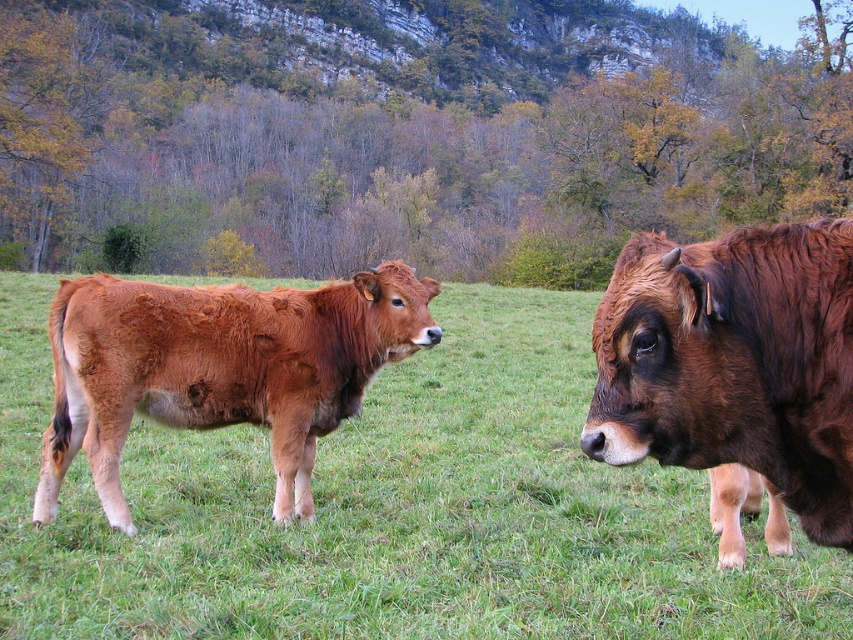
Who is lower down, green grass at center or brown glossy cow at right?

brown glossy cow at right is below.

I want to click on green grass at center, so coord(393,509).

Measure the distance between point (619, 538) and camera.

4.47 meters

Where is `green grass at center`? green grass at center is located at coordinates (393, 509).

Who is positioned more to the left, brown glossy cow at right or brown furry calf at left?

From the viewer's perspective, brown furry calf at left appears more on the left side.

Does brown glossy cow at right have a larger size compared to brown furry calf at left?

No.

The image size is (853, 640). Describe the element at coordinates (734, 372) in the screenshot. I see `brown glossy cow at right` at that location.

Locate an element on the screen. This screenshot has height=640, width=853. brown glossy cow at right is located at coordinates (734, 372).

Based on the photo, which is above, green grass at center or brown furry calf at left?

green grass at center

The image size is (853, 640). Find the location of `green grass at center`. green grass at center is located at coordinates (393, 509).